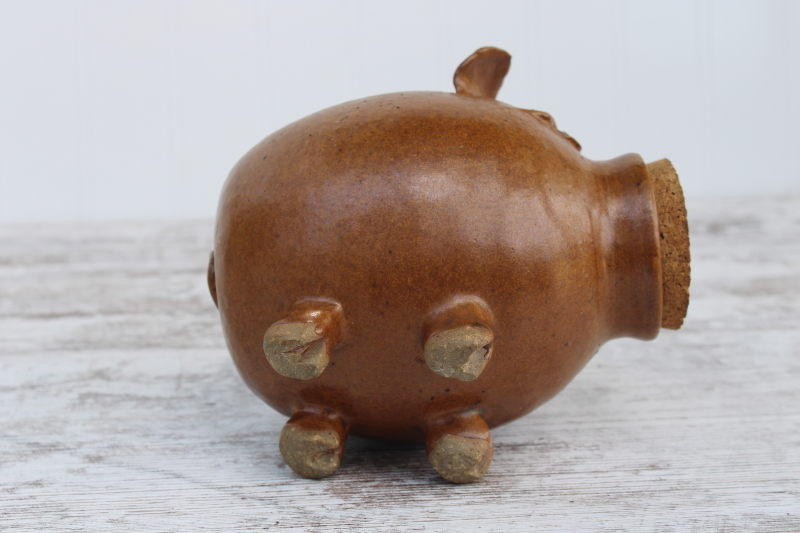
Where is `cork`? This screenshot has height=533, width=800. cork is located at coordinates (668, 260).